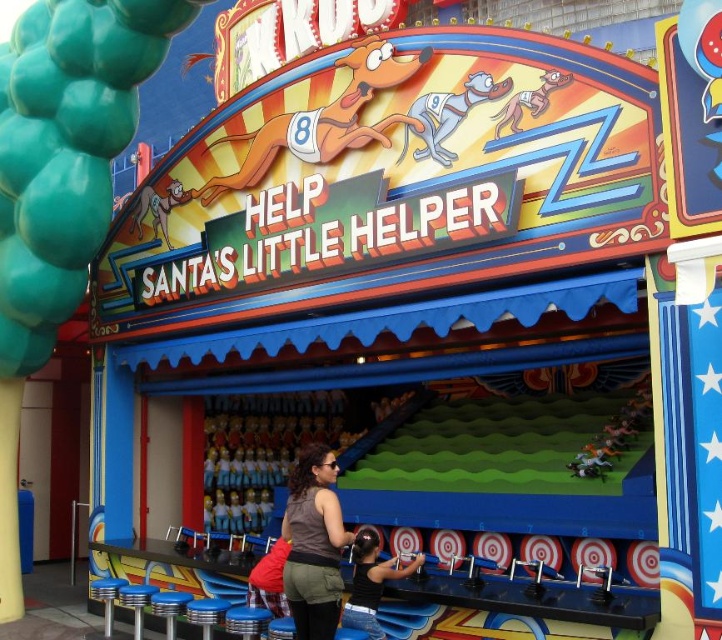
Measure the distance between matte orange dog at center and gray fabric dog at center.

The distance of matte orange dog at center from gray fabric dog at center is 3.62 meters.

Does matte orange dog at center come in front of gray fabric dog at center?

No, matte orange dog at center is further to the viewer.

The image size is (722, 640). What are the coordinates of `matte orange dog at center` in the screenshot? It's located at (323, 120).

The width and height of the screenshot is (722, 640). I want to click on matte orange dog at center, so click(323, 120).

How much distance is there between black t-shirt at center and matte yellow dog at upper center?

They are 61.16 feet apart.

Between black t-shirt at center and matte yellow dog at upper center, which one has more height?

Standing taller between the two is black t-shirt at center.

Where is `black t-shirt at center`? The width and height of the screenshot is (722, 640). black t-shirt at center is located at coordinates (370, 580).

You are a GUI agent. You are given a task and a screenshot of the screen. Output one action in this format:
    pyautogui.click(x=<x>, y=<y>)
    Task: Click on the black t-shirt at center
    The width and height of the screenshot is (722, 640).
    Given the screenshot: What is the action you would take?
    pyautogui.click(x=370, y=580)

Does gray fabric dog at center appear on the right side of black t-shirt at center?

Yes, gray fabric dog at center is to the right of black t-shirt at center.

Does gray fabric dog at center have a larger size compared to black t-shirt at center?

No.

Locate an element on the screen. gray fabric dog at center is located at coordinates (448, 115).